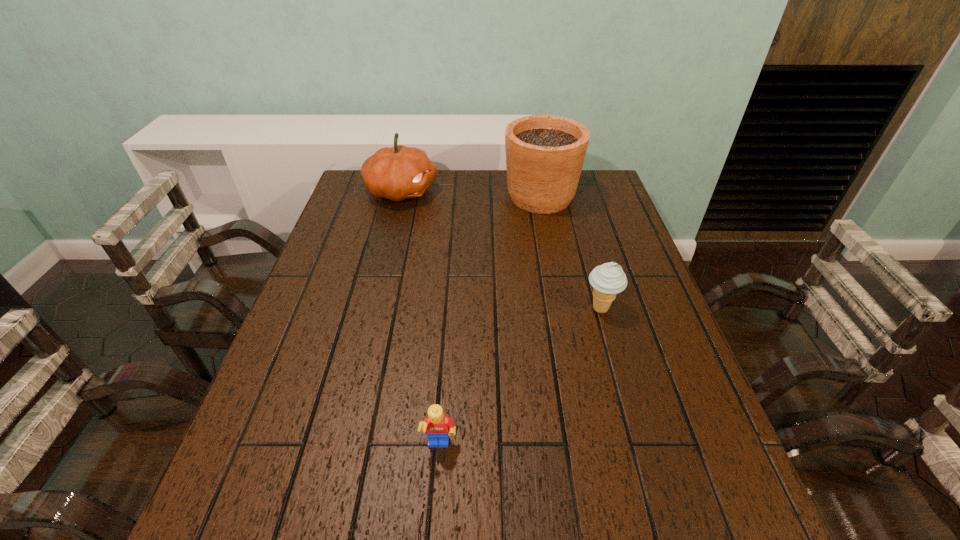
Find the location of a particular element. vacant area at the left edge of the desktop is located at coordinates (311, 316).

I want to click on free space at the right edge of the desktop, so click(603, 211).

The height and width of the screenshot is (540, 960). I want to click on free region at the far left corner, so click(347, 191).

You are a GUI agent. You are given a task and a screenshot of the screen. Output one action in this format:
    pyautogui.click(x=<x>, y=<y>)
    Task: Click on the vacant space at the far right corner
    The width and height of the screenshot is (960, 540).
    Given the screenshot: What is the action you would take?
    pyautogui.click(x=610, y=185)

At what (x,y) coordinates should I click in order to perform the action: click on vacant area between the tallest object and the nearest object. Please return your answer as a coordinate pair (x, y). The width and height of the screenshot is (960, 540). Looking at the image, I should click on (490, 321).

You are a GUI agent. You are given a task and a screenshot of the screen. Output one action in this format:
    pyautogui.click(x=<x>, y=<y>)
    Task: Click on the free space that is in between the pumpkin and the icecream
    The height and width of the screenshot is (540, 960).
    Given the screenshot: What is the action you would take?
    pyautogui.click(x=501, y=250)

You are a GUI agent. You are given a task and a screenshot of the screen. Output one action in this format:
    pyautogui.click(x=<x>, y=<y>)
    Task: Click on the vacant space that is in between the second shortest object and the shortest object
    The image size is (960, 540).
    Given the screenshot: What is the action you would take?
    pyautogui.click(x=520, y=377)

The image size is (960, 540). In order to click on empty space that is in between the flowerpot and the pumpkin in this screenshot , I will do `click(471, 194)`.

Identify the location of unoccupied position between the shortest object and the second shortest object. (520, 377).

Locate an element on the screen. The width and height of the screenshot is (960, 540). vacant area that lies between the second object from left to right and the flowerpot is located at coordinates (490, 321).